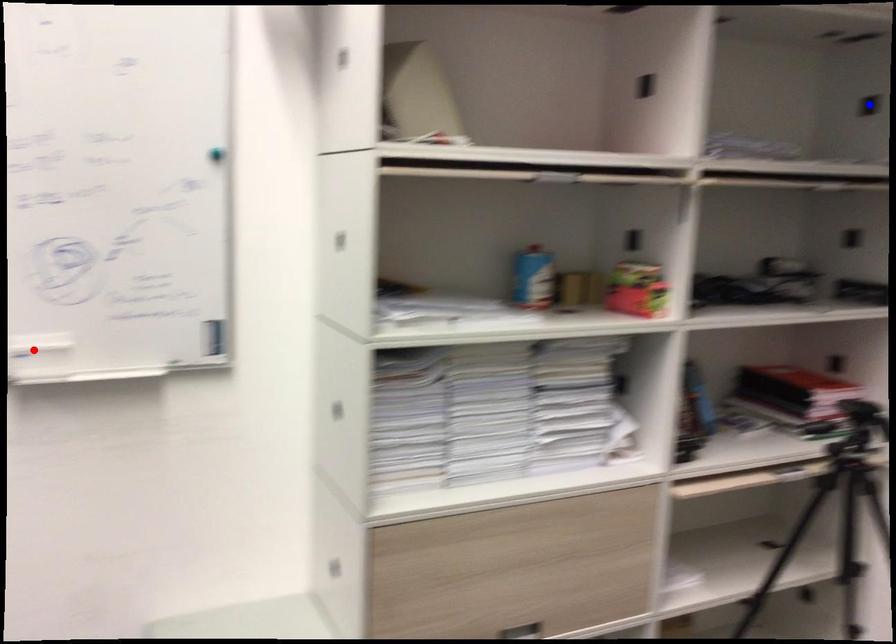
Question: Two points are marked on the image. Which point is closer to the camera?

Choices:
 (A) Blue point is closer.
 (B) Red point is closer.

Answer: (B)